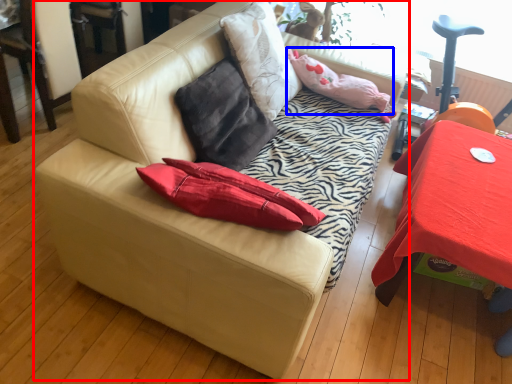
Question: Among these objects, which one is farthest to the camera, studio couch (highlighted by a red box) or pillow (highlighted by a blue box)?

Choices:
 (A) studio couch
 (B) pillow

Answer: (B)